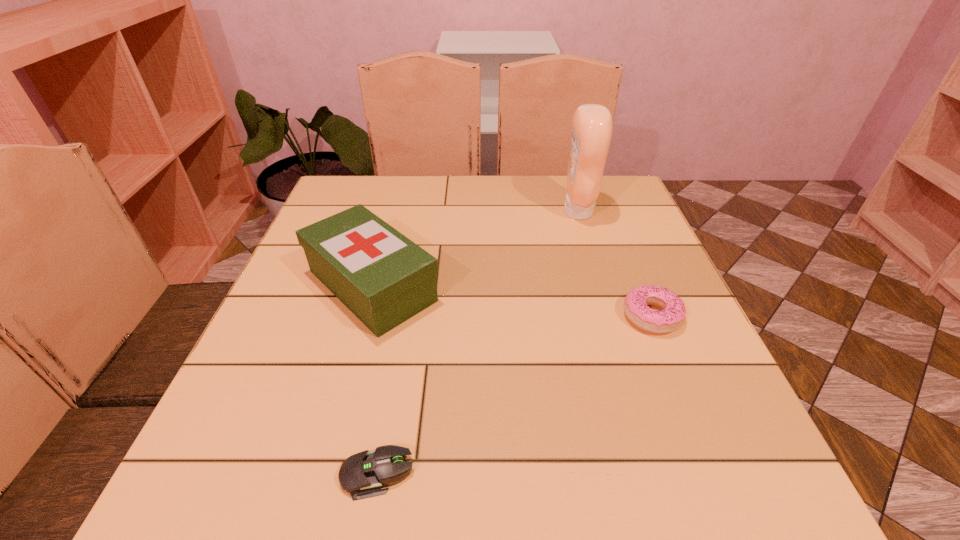
Where is `free region that satisfies the following two spatial constraints: 1. on the label of the farthest object; 2. on the right side of the doughnut`? The height and width of the screenshot is (540, 960). free region that satisfies the following two spatial constraints: 1. on the label of the farthest object; 2. on the right side of the doughnut is located at coordinates (610, 316).